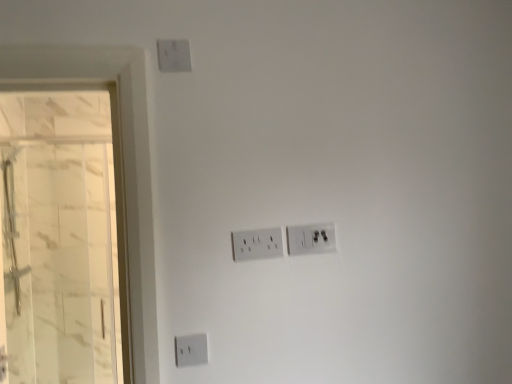
Question: Is white marble glass door at left positioned in front of white plastic power plugs and sockets at center, placed as the second power plugs and sockets when sorted from left to right?

Choices:
 (A) yes
 (B) no

Answer: (B)

Question: Considering the relative sizes of white marble glass door at left and white plastic power plugs and sockets at center, placed as the second power plugs and sockets when sorted from left to right, in the image provided, is white marble glass door at left thinner than white plastic power plugs and sockets at center, placed as the second power plugs and sockets when sorted from left to right,?

Choices:
 (A) yes
 (B) no

Answer: (B)

Question: Is white marble glass door at left outside white plastic power plugs and sockets at center, placed as the second power plugs and sockets when sorted from left to right?

Choices:
 (A) no
 (B) yes

Answer: (B)

Question: Considering the relative positions of white marble glass door at left and white plastic power plugs and sockets at center, placed as the second power plugs and sockets when sorted from left to right, in the image provided, is white marble glass door at left behind white plastic power plugs and sockets at center, placed as the second power plugs and sockets when sorted from left to right,?

Choices:
 (A) no
 (B) yes

Answer: (B)

Question: Can you see white marble glass door at left touching white plastic power plugs and sockets at center, marked as the 1th power plugs and sockets in a right-to-left arrangement?

Choices:
 (A) yes
 (B) no

Answer: (B)

Question: Can you confirm if white marble glass door at left is taller than white plastic power plugs and sockets at center, placed as the second power plugs and sockets when sorted from left to right?

Choices:
 (A) yes
 (B) no

Answer: (A)

Question: Can you confirm if white plastic power plugs and sockets at center, marked as the 1th power plugs and sockets in a right-to-left arrangement, is positioned to the left of white plastic power plugs and sockets at center, the 1th power plugs and sockets viewed from the left?

Choices:
 (A) no
 (B) yes

Answer: (A)

Question: From a real-world perspective, does white plastic power plugs and sockets at center, placed as the second power plugs and sockets when sorted from left to right, sit lower than white plastic power plugs and sockets at center, the 1th power plugs and sockets viewed from the left?

Choices:
 (A) yes
 (B) no

Answer: (B)

Question: Does white plastic power plugs and sockets at center, placed as the second power plugs and sockets when sorted from left to right, have a smaller size compared to white plastic power plugs and sockets at center, the 1th power plugs and sockets viewed from the left?

Choices:
 (A) no
 (B) yes

Answer: (A)

Question: Is white plastic power plugs and sockets at center, marked as the 1th power plugs and sockets in a right-to-left arrangement, not inside white plastic power plugs and sockets at center, which is the 2th power plugs and sockets in right-to-left order?

Choices:
 (A) no
 (B) yes

Answer: (B)

Question: Is the surface of white plastic power plugs and sockets at center, marked as the 1th power plugs and sockets in a right-to-left arrangement, in direct contact with white plastic power plugs and sockets at center, the 1th power plugs and sockets viewed from the left?

Choices:
 (A) yes
 (B) no

Answer: (A)

Question: From the image's perspective, is white plastic power plugs and sockets at center, placed as the second power plugs and sockets when sorted from left to right, above white plastic power plugs and sockets at center, which is the 2th power plugs and sockets in right-to-left order?

Choices:
 (A) no
 (B) yes

Answer: (B)

Question: Could you tell me if white plastic power plugs and sockets at center, the 1th power plugs and sockets viewed from the left, is facing white plastic power plugs and sockets at center, marked as the 1th power plugs and sockets in a right-to-left arrangement?

Choices:
 (A) yes
 (B) no

Answer: (B)